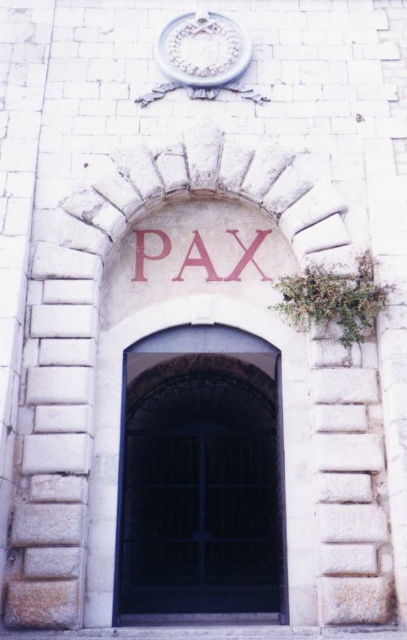
You are a visitor approaching the entrance of the building. You see the black metal gate at center and the white stone clock at upper center. Which object is closer to the entrance as you approach?

The black metal gate at center is closer to the entrance as you approach because it is positioned under the white stone clock at upper center, meaning it is below it spatially and thus nearer to the entrance area.

Consider the image. You are an architect examining the building facade. You need to install a new security camera that must be placed above both the white stone clock at upper center and the red stone lettering at center. Based on their current positions and sizes, where should the camera be positioned to ensure it is above both objects?

The white stone clock at upper center is taller than the red stone lettering at center. To place the camera above both, position it above the white stone clock at upper center since it is the taller object and placing it there would naturally be above the shorter red stone lettering at center as well.

You are an architect examining the building facade. You notice the white stone clock at upper center and the red stone lettering at center. Which object appears closer to you based on their spatial relationship?

The white stone clock at upper center appears closer because the red stone lettering at center is behind it.